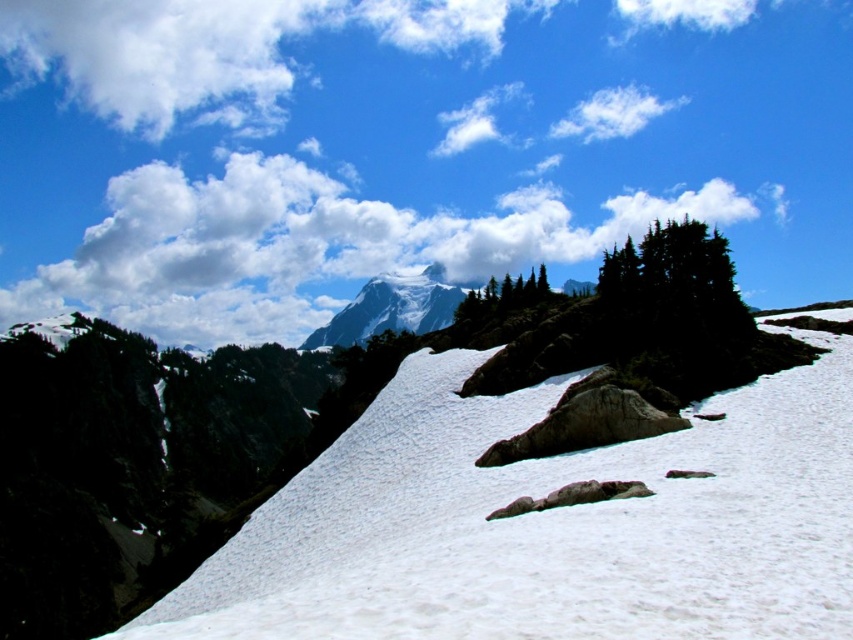
Does point (741, 312) lie in front of point (485, 308)?

Yes, it is.

Is dark green textured tree at upper center to the right of green matte tree at upper center from the viewer's perspective?

Correct, you'll find dark green textured tree at upper center to the right of green matte tree at upper center.

What do you see at coordinates (675, 301) in the screenshot?
I see `dark green textured tree at upper center` at bounding box center [675, 301].

Identify the location of dark green textured tree at upper center. (675, 301).

Between point (732, 451) and point (549, 292), which one is positioned in front?

Point (732, 451)

Is white snow at center above green matte tree at upper center?

No, white snow at center is not above green matte tree at upper center.

Which is behind, point (384, 566) or point (482, 321)?

Point (482, 321)

Identify the location of white snow at center. (546, 524).

Is white fluffy cloud at upper left closer to the viewer compared to dark green textured tree at upper center?

No, white fluffy cloud at upper left is further to the viewer.

Who is positioned more to the right, white fluffy cloud at upper left or dark green textured tree at upper center?

dark green textured tree at upper center is more to the right.

Measure the distance between white fluffy cloud at upper left and camera.

The distance of white fluffy cloud at upper left from camera is 2014.29 feet.

The height and width of the screenshot is (640, 853). I want to click on white fluffy cloud at upper left, so click(x=160, y=54).